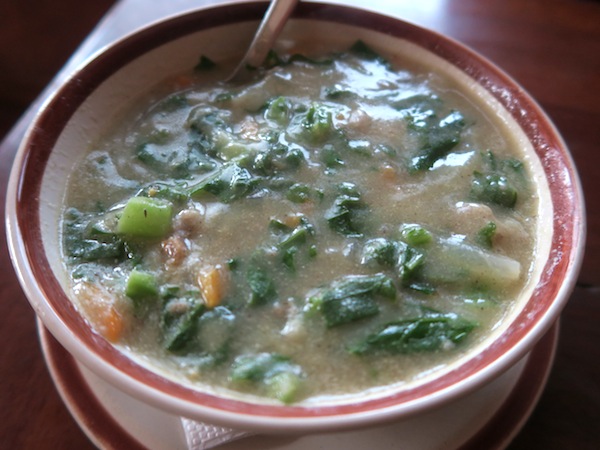
Where is `saucer under plate`? Image resolution: width=600 pixels, height=450 pixels. saucer under plate is located at coordinates (152, 421).